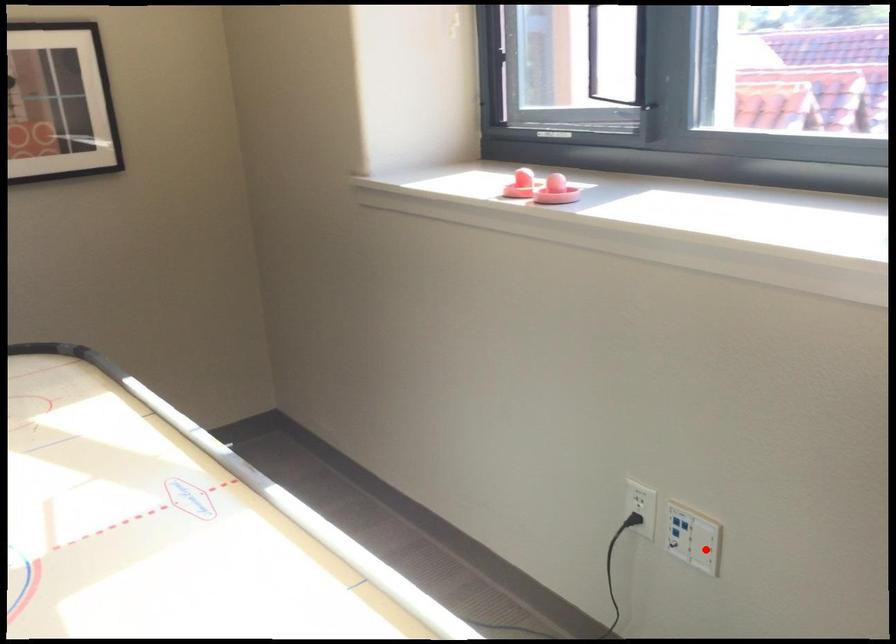
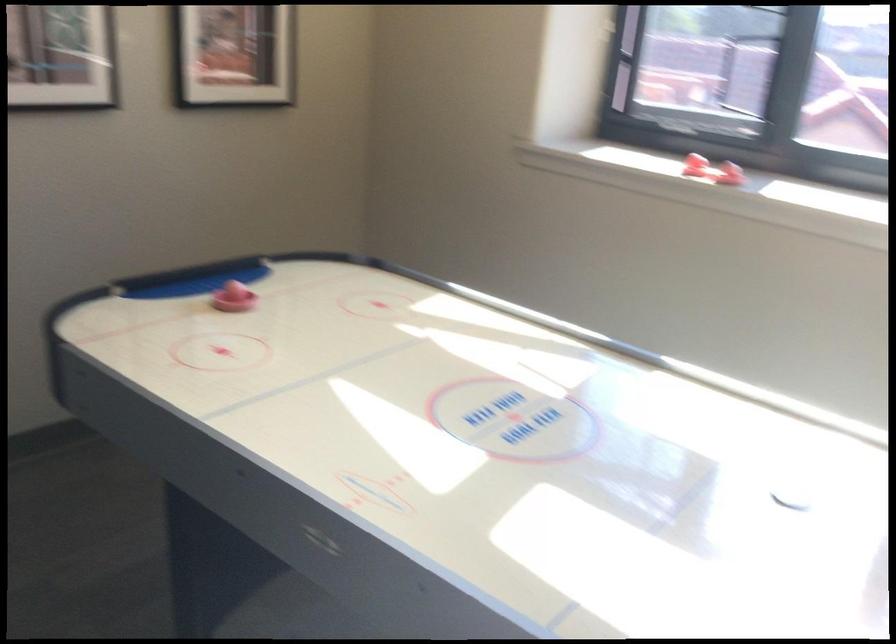
Question: I am providing you with two images of the same scene from different viewpoints. A red point is marked on the first image. Is the red point's position out of view in image 2?

Choices:
 (A) Yes
 (B) No

Answer: (A)